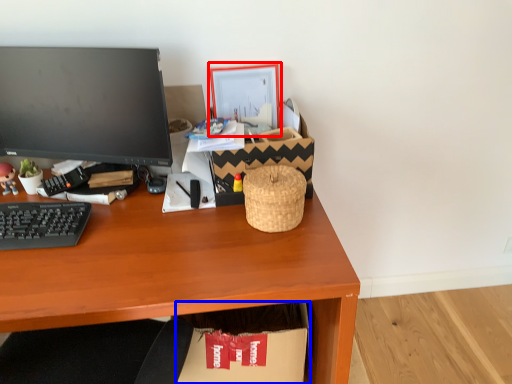
Question: Which object is closer to the camera taking this photo, picture frame (highlighted by a red box) or cardboard box (highlighted by a blue box)?

Choices:
 (A) picture frame
 (B) cardboard box

Answer: (B)